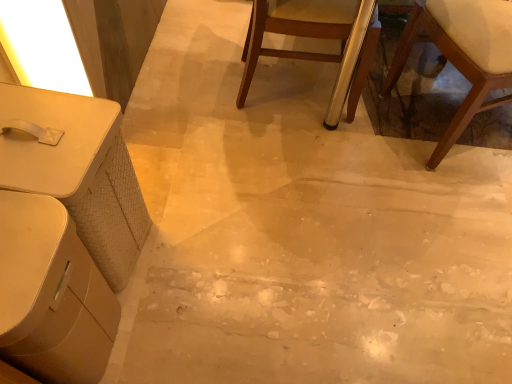
The width and height of the screenshot is (512, 384). Identify the location of blank space above white matte table at left, the second table positioned from the bottom (from a real-world perspective). (42, 130).